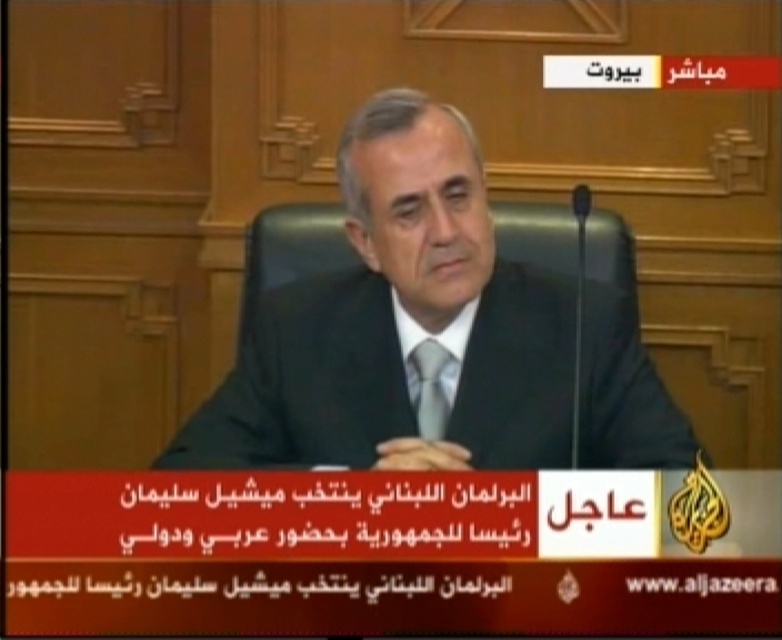
You are a fashion designer analyzing this image. You need to determine if the black suit at center is layered over the matte gray tie at center. Based on the spatial arrangement, can you confirm this?

The black suit at center is closer to the viewer than the matte gray tie at center, which means the black suit is layered over the matte gray tie at center.

You are a costume designer preparing for a historical drama. You need to ensure that the black suit at center and the matte gray tie at center are proportionally accurate. Based on the image, which object should you adjust to achieve the correct proportions?

The black suit at center has a larger size compared to the matte gray tie at center. To achieve correct proportions, you should adjust the matte gray tie at center to be smaller or the black suit at center to be larger, ensuring they align with the size relationship shown in the image.